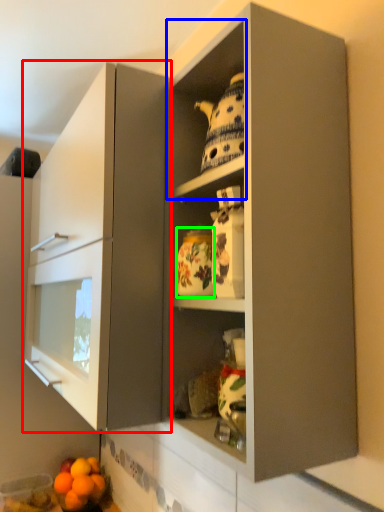
Question: Estimate the real-world distances between objects in this image. Which object is farther from cabinetry (highlighted by a red box), cabinet (highlighted by a blue box) or pottery (highlighted by a green box)?

Choices:
 (A) cabinet
 (B) pottery

Answer: (B)